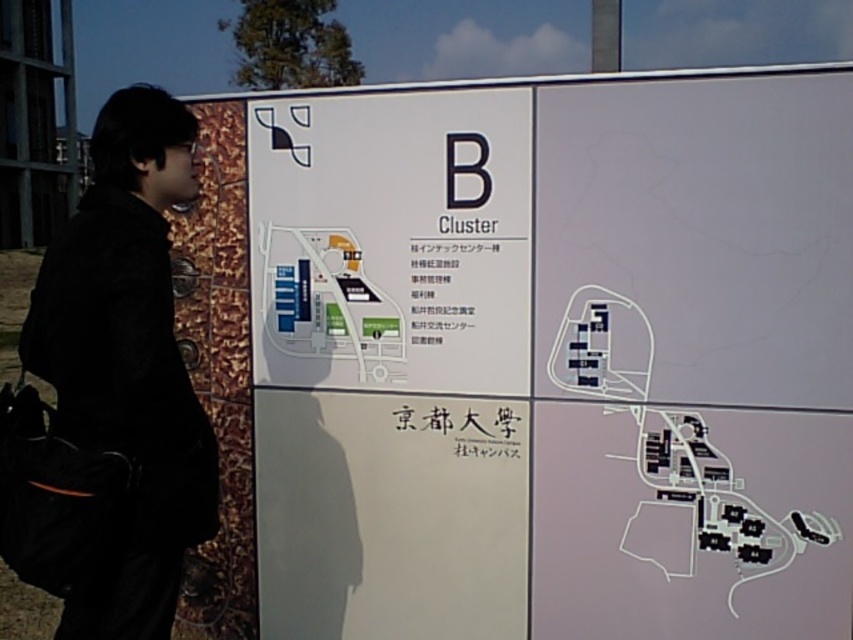
Question: Based on their relative distances, which object is farther from the white paper sign at center?

Choices:
 (A) white paper map at upper center
 (B) black fabric jacket at left

Answer: (B)

Question: Estimate the real-world distances between objects in this image. Which object is closer to the white paper map at upper center?

Choices:
 (A) white paper sign at center
 (B) black fabric jacket at left

Answer: (A)

Question: Is white paper sign at center further to camera compared to black fabric jacket at left?

Choices:
 (A) no
 (B) yes

Answer: (B)

Question: Among these points, which one is farthest from the camera?

Choices:
 (A) [x=529, y=225]
 (B) [x=387, y=218]

Answer: (B)

Question: In this image, where is white paper map at upper center located relative to white paper sign at center?

Choices:
 (A) right
 (B) left

Answer: (A)

Question: Is white paper sign at center to the right of black fabric jacket at left from the viewer's perspective?

Choices:
 (A) no
 (B) yes

Answer: (B)